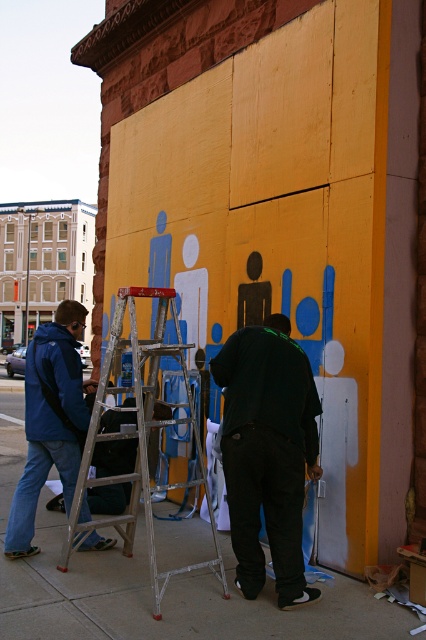
Question: Among these points, which one is farthest from the camera?

Choices:
 (A) (371, 609)
 (B) (247, 417)

Answer: (A)

Question: Is dark green shirt at center further to camera compared to blue matte jacket at left?

Choices:
 (A) yes
 (B) no

Answer: (B)

Question: Can you confirm if concrete sidewalk at lower center is bigger than blue matte jacket at left?

Choices:
 (A) no
 (B) yes

Answer: (B)

Question: Which object is the farthest from the concrete sidewalk at lower center?

Choices:
 (A) dark green shirt at center
 (B) blue matte jacket at left

Answer: (B)

Question: Does concrete sidewalk at lower center come in front of dark green shirt at center?

Choices:
 (A) yes
 (B) no

Answer: (A)

Question: Which object is closer to the camera taking this photo?

Choices:
 (A) concrete sidewalk at lower center
 (B) silver metallic ladder at center

Answer: (A)